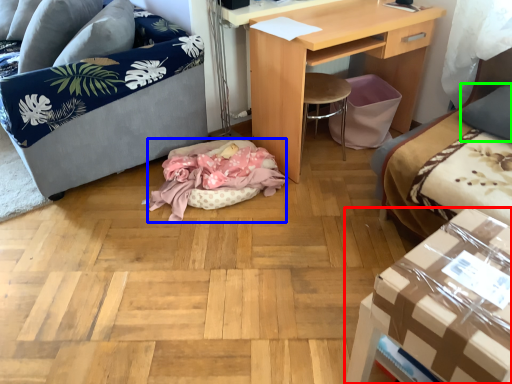
Question: Estimate the real-world distances between objects in this image. Which object is farther from table (highlighted by a red box), cat bed (highlighted by a blue box) or pillow (highlighted by a green box)?

Choices:
 (A) cat bed
 (B) pillow

Answer: (A)